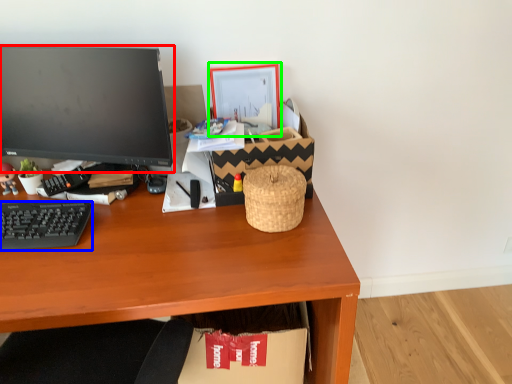
Question: Considering the real-world distances, which object is closest to computer monitor (highlighted by a red box)? computer keyboard (highlighted by a blue box) or picture frame (highlighted by a green box).

Choices:
 (A) computer keyboard
 (B) picture frame

Answer: (A)